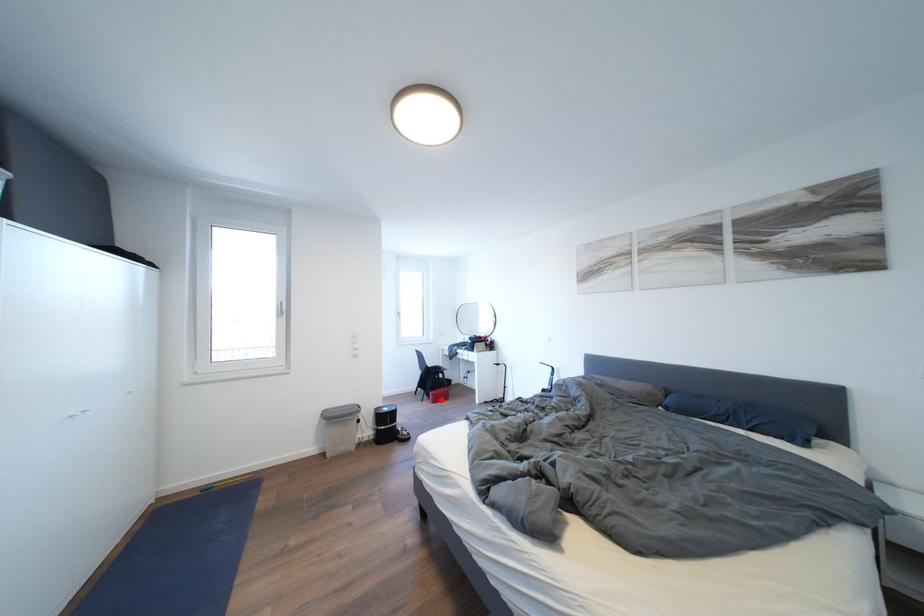
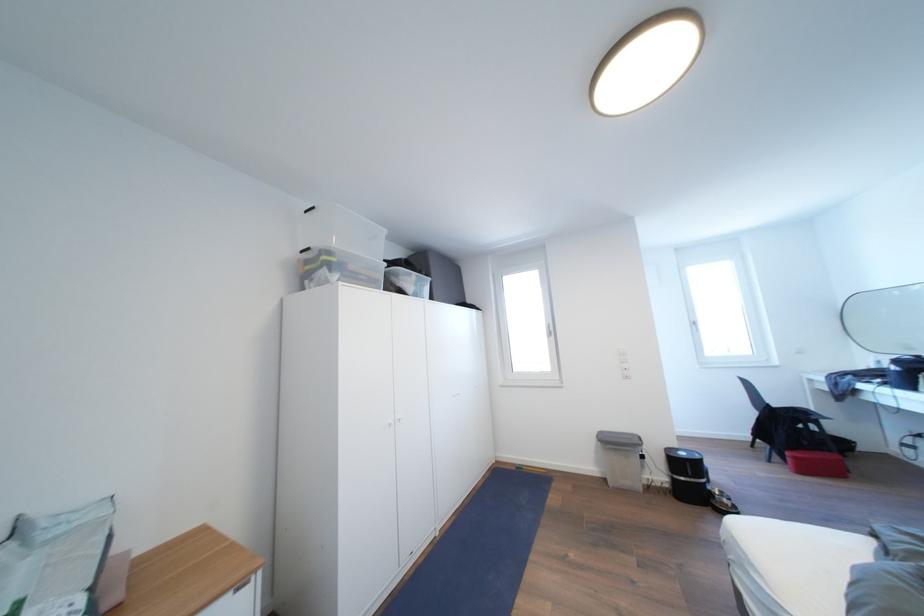
Find the pixel in the second image that matches the highlighted location in the first image.

(803, 463)